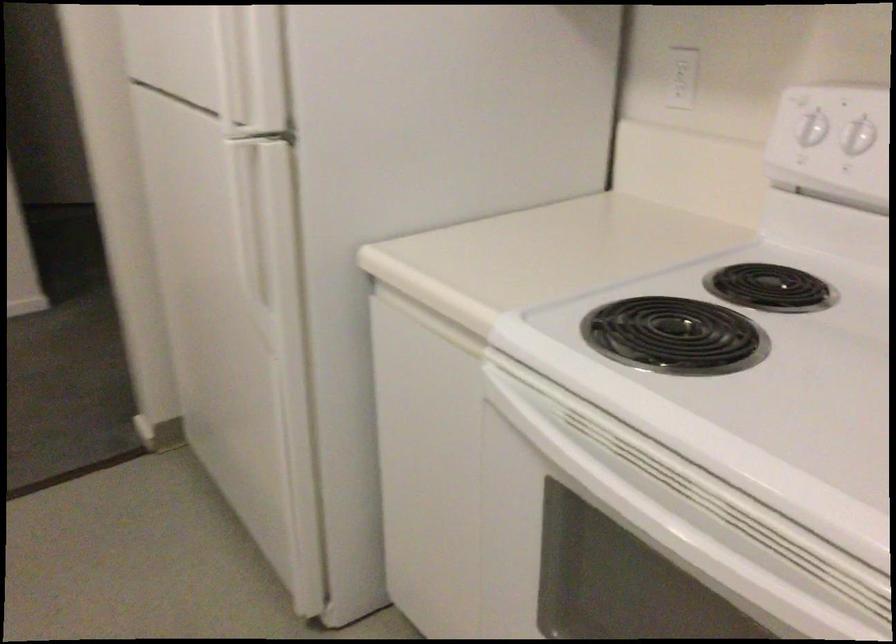
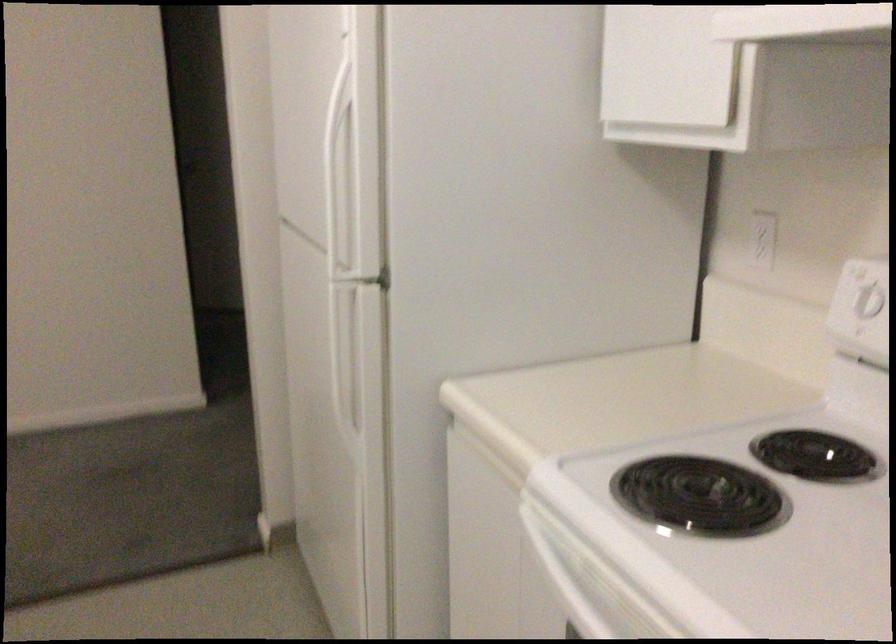
Find the pixel in the second image that matches (x=805, y=115) in the first image.

(864, 289)